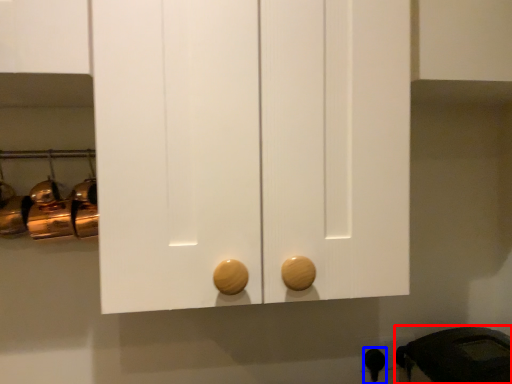
Question: Which object is further to the camera taking this photo, appliance (highlighted by a red box) or door handle (highlighted by a blue box)?

Choices:
 (A) appliance
 (B) door handle

Answer: (B)